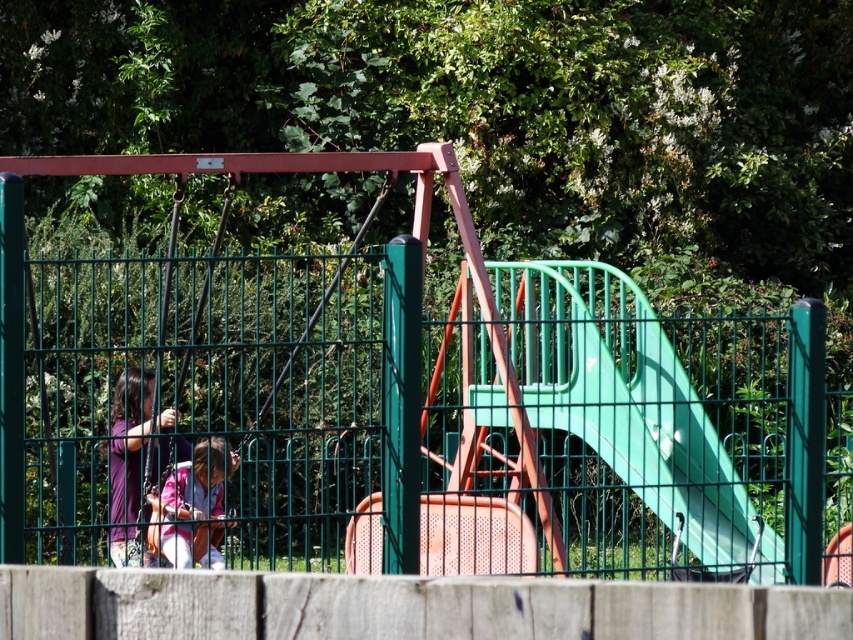
Between pink fabric dress at left and pink fabric at lower left, which one has more height?

With more height is pink fabric dress at left.

Based on the photo, who is more distant from viewer, (149, 396) or (200, 515)?

Positioned behind is point (149, 396).

Which is in front, point (149, 506) or point (184, 496)?

Point (184, 496) is in front.

Find the location of `pink fabric dress at left`. pink fabric dress at left is located at coordinates (132, 464).

Where is `green metal fence at center`? The width and height of the screenshot is (853, 640). green metal fence at center is located at coordinates (439, 419).

Measure the distance between green metal fence at center and camera.

green metal fence at center and camera are 10.85 meters apart.

Image resolution: width=853 pixels, height=640 pixels. What do you see at coordinates (439, 419) in the screenshot? I see `green metal fence at center` at bounding box center [439, 419].

Locate an element on the screen. The width and height of the screenshot is (853, 640). green metal fence at center is located at coordinates (439, 419).

Does pink fabric at lower left come behind metallic swing at left?

That is False.

Who is more distant from viewer, (148, 500) or (183, 381)?

Point (183, 381)

Locate an element on the screen. pink fabric at lower left is located at coordinates pyautogui.click(x=193, y=506).